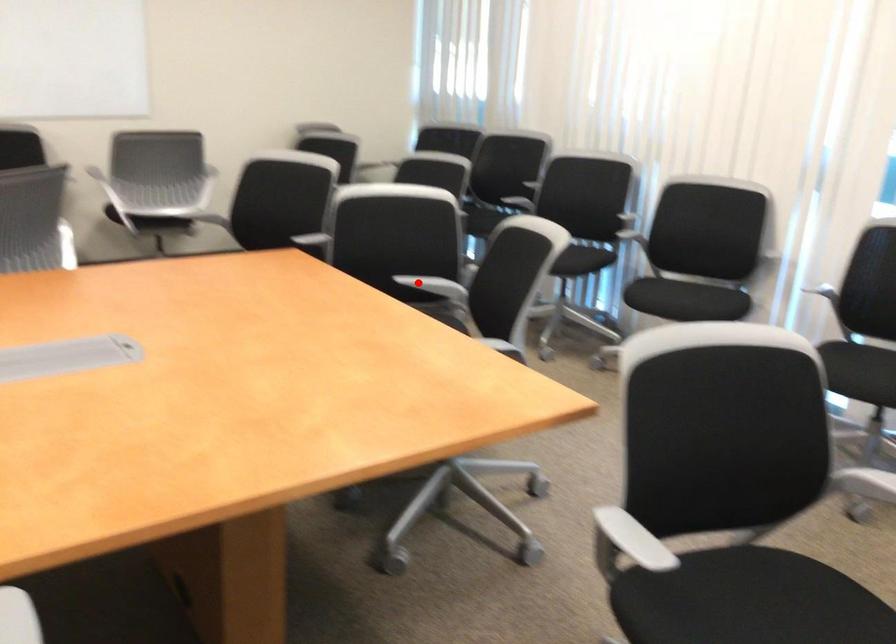
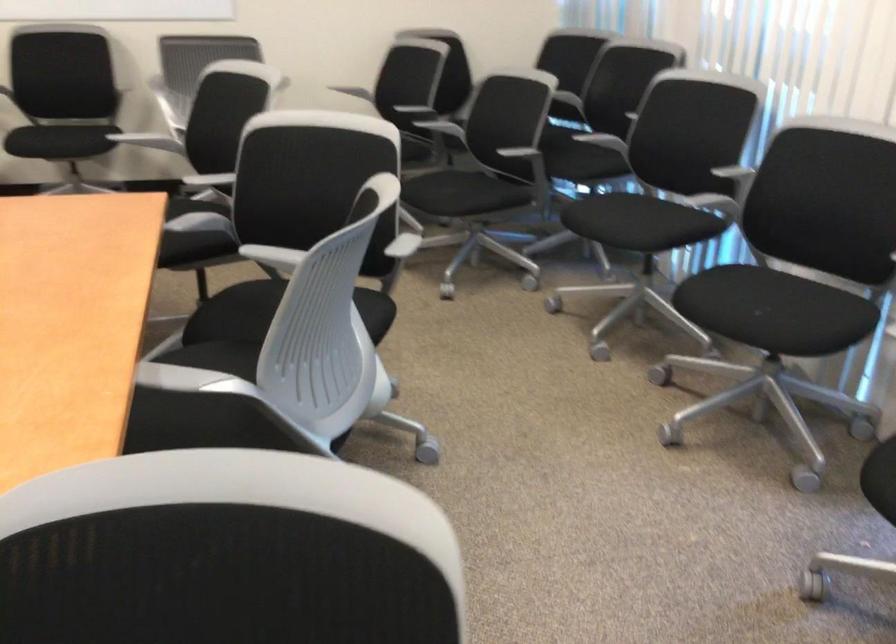
Where in the second image is the point corresponding to the highlighted location from the first image?

(273, 258)